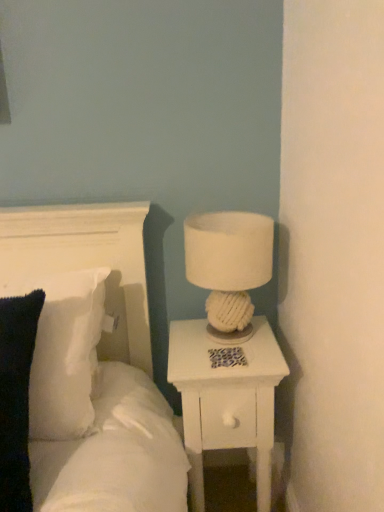
Question: From their relative heights in the image, would you say white soft pillow at upper left is taller or shorter than white soft pillow at left?

Choices:
 (A) tall
 (B) short

Answer: (A)

Question: Is white soft pillow at upper left in front of or behind white soft pillow at left in the image?

Choices:
 (A) behind
 (B) front

Answer: (B)

Question: Which of these objects is positioned farthest from the white soft pillow at left?

Choices:
 (A) white soft pillow at upper left
 (B) white wood nightstand at right
 (C) white fabric lampshade at upper right

Answer: (C)

Question: Considering the real-world distances, which object is closest to the white soft pillow at upper left?

Choices:
 (A) white soft pillow at left
 (B) white wood nightstand at right
 (C) white fabric lampshade at upper right

Answer: (A)